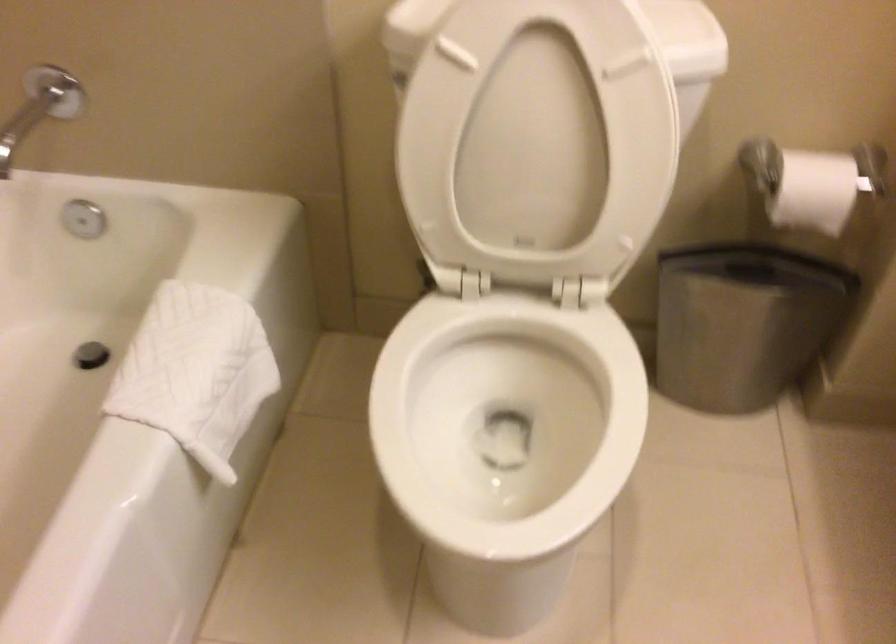
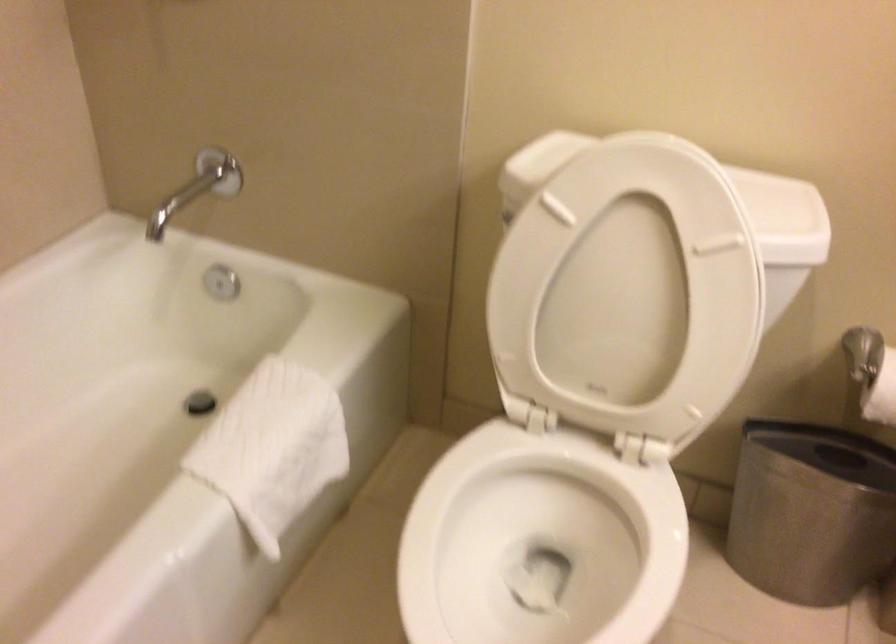
Where in the second image is the point corresponding to (x=494, y=406) from the first image?

(539, 542)